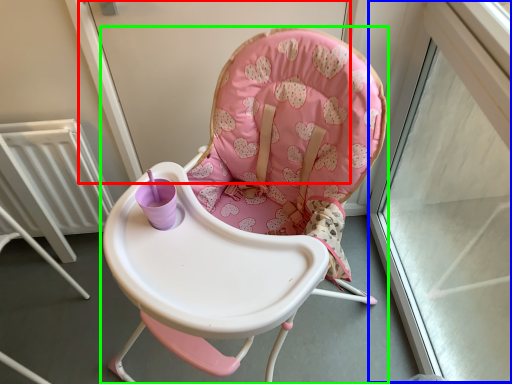
Question: Which object is positioned farthest from screen door (highlighted by a red box)? Select from window frame (highlighted by a blue box) and chair (highlighted by a green box).

Choices:
 (A) window frame
 (B) chair

Answer: (A)